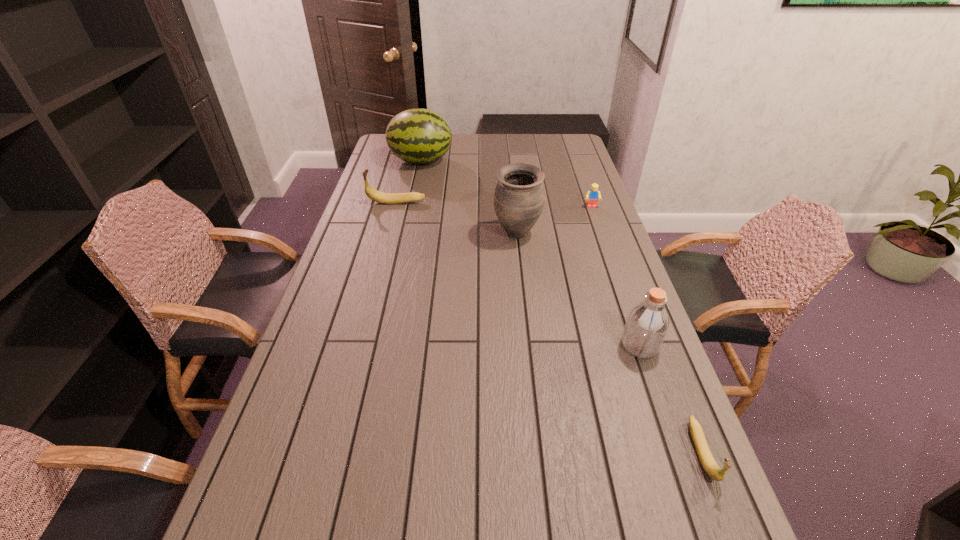
Locate an element on the screen. This screenshot has width=960, height=540. the third shortest object is located at coordinates (388, 198).

Where is `the left banana`? the left banana is located at coordinates (388, 198).

This screenshot has height=540, width=960. Identify the location of the right banana. (710, 466).

Where is `the nearer banana`? the nearer banana is located at coordinates (710, 466).

Image resolution: width=960 pixels, height=540 pixels. I want to click on the farthest object, so click(x=420, y=136).

This screenshot has height=540, width=960. Identify the location of the fourth object from right to left. (519, 194).

The width and height of the screenshot is (960, 540). In order to click on urn in this screenshot , I will do `click(519, 194)`.

I want to click on the fifth farthest object, so click(647, 323).

At what (x,y) coordinates should I click in order to perform the action: click on the fourth shortest object. Please return your answer as a coordinate pair (x, y). The height and width of the screenshot is (540, 960). Looking at the image, I should click on (647, 323).

The width and height of the screenshot is (960, 540). What are the coordinates of `Lego` in the screenshot? It's located at (593, 194).